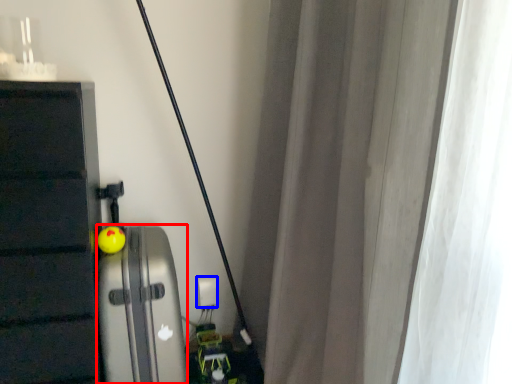
Question: Among these objects, which one is farthest to the camera, appliance (highlighted by a red box) or electric outlet (highlighted by a blue box)?

Choices:
 (A) appliance
 (B) electric outlet

Answer: (B)